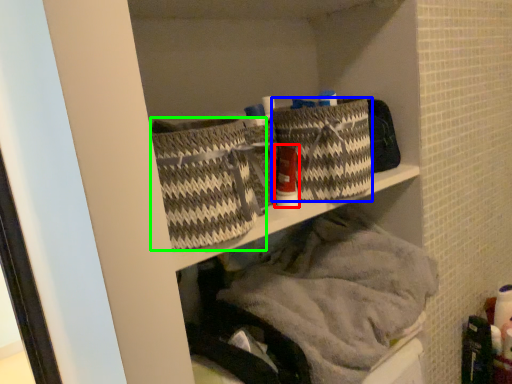
Question: Estimate the real-world distances between objects in this image. Which object is farther from toiletry (highlighted by a red box), basket (highlighted by a blue box) or basket (highlighted by a green box)?

Choices:
 (A) basket
 (B) basket

Answer: (B)